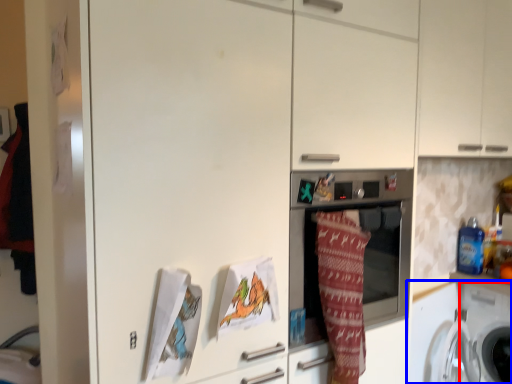
Question: Among these objects, which one is nearest to the camera, washing machine (highlighted by a red box) or washing machine (highlighted by a blue box)?

Choices:
 (A) washing machine
 (B) washing machine

Answer: (B)